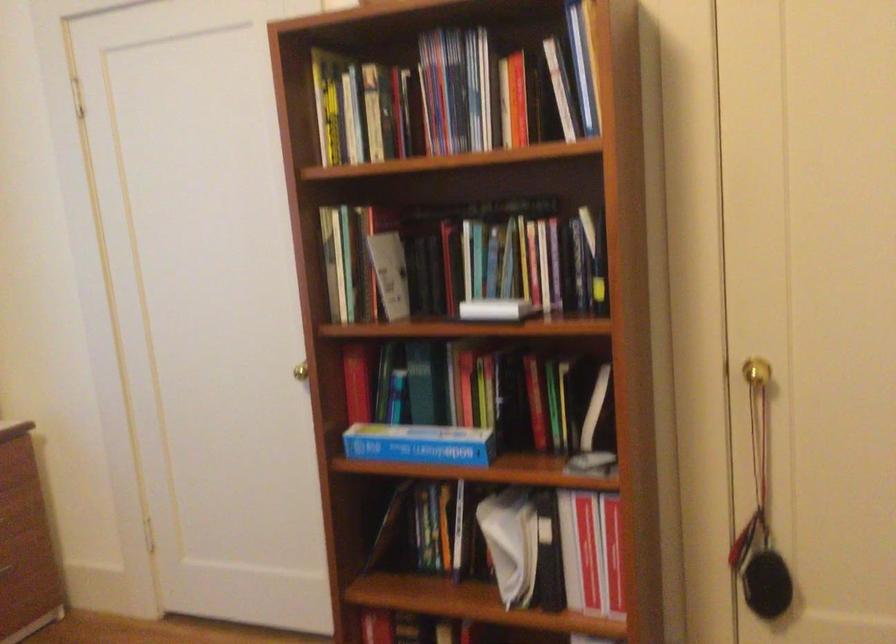
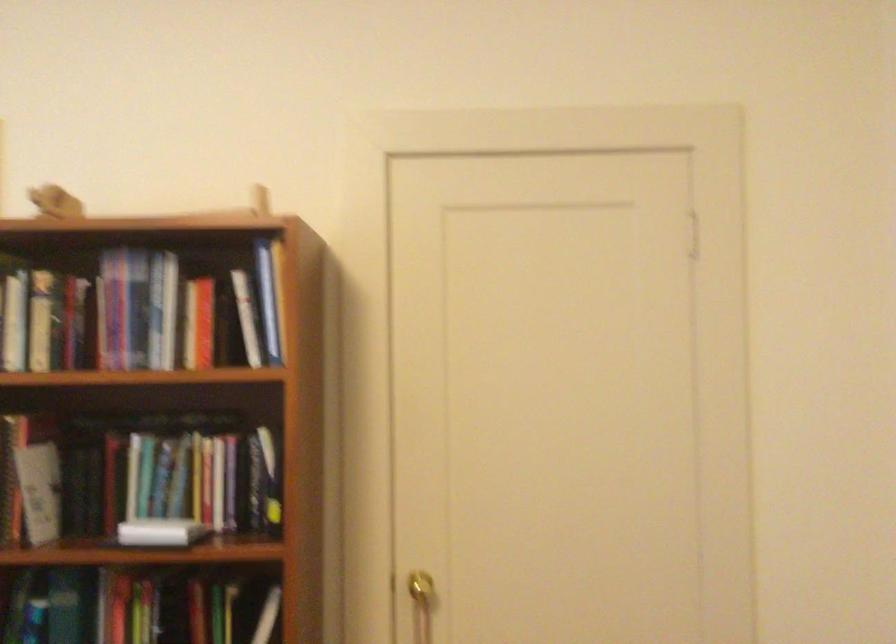
What movement of the cameraman would produce the second image?

The cameraman moved toward left, backward.